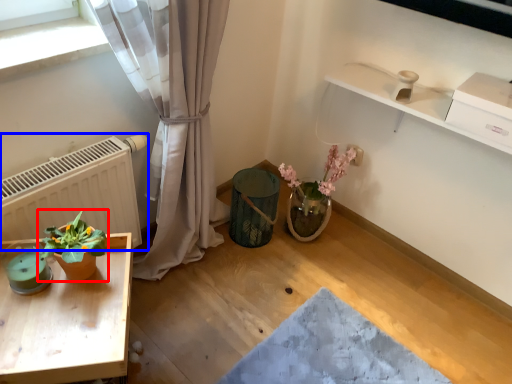
Question: Among these objects, which one is nearest to the camera, houseplant (highlighted by a red box) or radiator (highlighted by a blue box)?

Choices:
 (A) houseplant
 (B) radiator

Answer: (A)